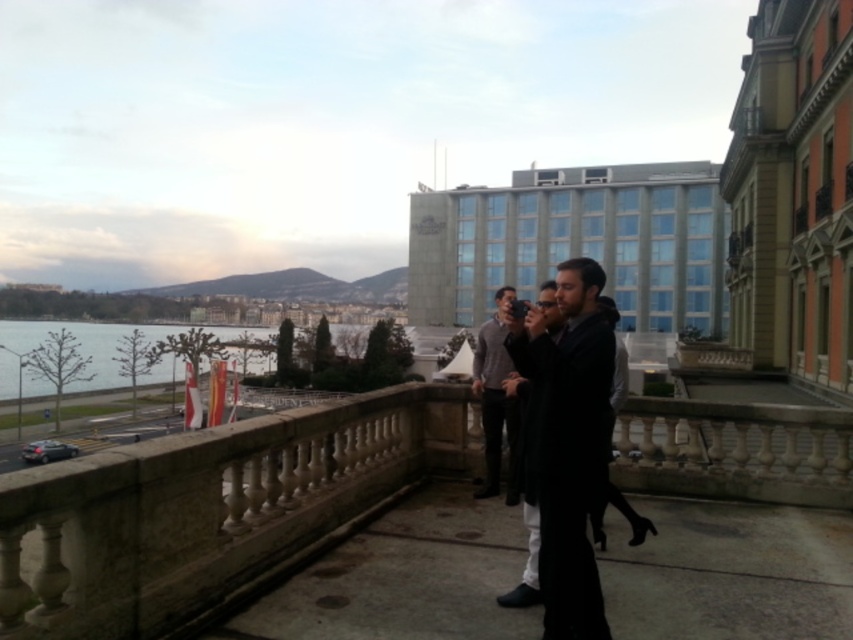
You are standing on the balcony and want to place a small potted plant between the two points labeled as point (596, 355) and point (241, 358). Which point should the plant be closer to in order to be nearer to the viewer?

The plant should be placed closer to point (596, 355) because it is closer to the viewer than point (241, 358).

You are standing on the balcony and want to place a small potted plant exactly at the point with coordinates (x=566, y=436). What object will the plant be placed on?

The point with coordinates (x=566, y=436) is on the black fabric coat at center, so the plant will be placed on the black fabric coat at center.

You are standing on the balcony and want to place both the concrete pavement at center and the black fabric coat at center on a shelf. Which object should you place first to ensure they both fit?

The concrete pavement at center has a smaller size compared to black fabric coat at center, so you should place the black fabric coat at center first to ensure both fit on the shelf.